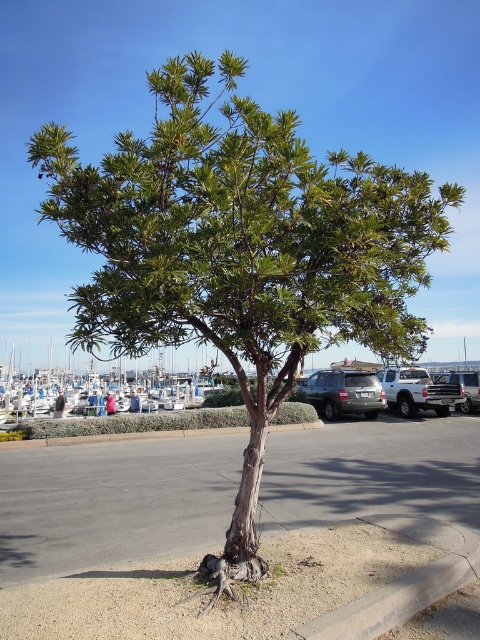
Question: Which object is closer to the camera taking this photo?

Choices:
 (A) satin silver suv at center
 (B) satin black suv at right
 (C) silver metallic truck at right

Answer: (A)

Question: Can you confirm if gray concrete curb at lower right is smaller than satin silver suv at center?

Choices:
 (A) no
 (B) yes

Answer: (B)

Question: Is satin silver suv at center closer to camera compared to silver metallic truck at right?

Choices:
 (A) yes
 (B) no

Answer: (A)

Question: Can you confirm if gray concrete curb at lower right is bigger than silver metallic truck at right?

Choices:
 (A) yes
 (B) no

Answer: (B)

Question: Which object is farther from the camera taking this photo?

Choices:
 (A) gray concrete curb at lower right
 (B) satin black suv at right
 (C) satin silver suv at center

Answer: (B)

Question: Which of the following is the closest to the observer?

Choices:
 (A) gray concrete curb at lower right
 (B) satin silver suv at center
 (C) silver metallic truck at right

Answer: (A)